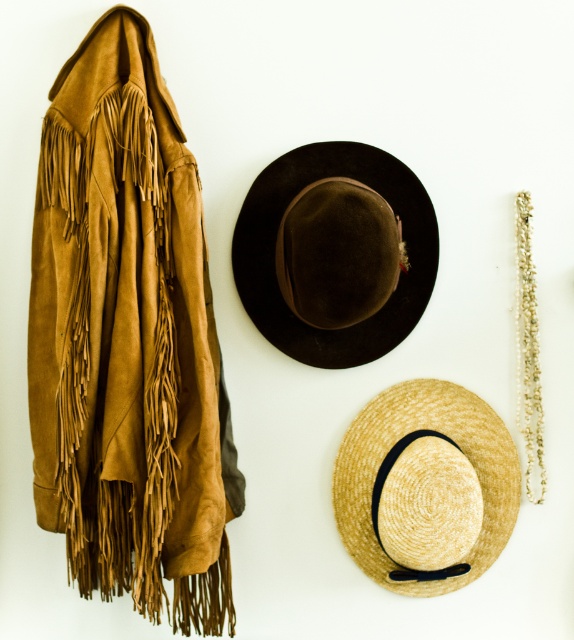
Is brown felt fedora at center further to the viewer compared to woven straw hat at center?

No.

The height and width of the screenshot is (640, 574). What do you see at coordinates (335, 252) in the screenshot? I see `brown felt fedora at center` at bounding box center [335, 252].

Locate an element on the screen. This screenshot has height=640, width=574. brown felt fedora at center is located at coordinates (335, 252).

Can you confirm if suede fringe jacket at left is shorter than woven straw hat at center?

In fact, suede fringe jacket at left may be taller than woven straw hat at center.

Can you confirm if suede fringe jacket at left is taller than woven straw hat at center?

Yes.

This screenshot has height=640, width=574. I want to click on suede fringe jacket at left, so click(127, 340).

Can you confirm if suede fringe jacket at left is shorter than brown felt fedora at center?

No, suede fringe jacket at left is not shorter than brown felt fedora at center.

Measure the distance between suede fringe jacket at left and brown felt fedora at center.

They are 8.88 inches apart.

Is point (176, 524) positioned behind point (290, 170)?

No, (176, 524) is in front of (290, 170).

Find the location of a particular element. suede fringe jacket at left is located at coordinates (127, 340).